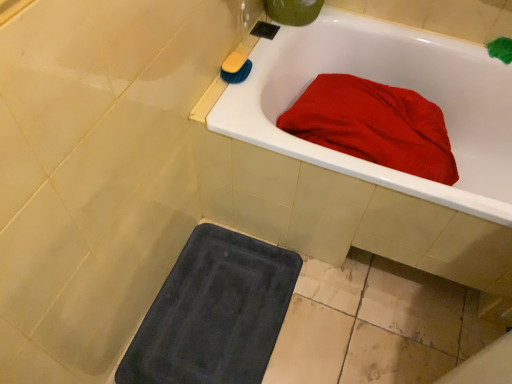
Question: Could you tell me if matte white bathtub at upper right is facing yellow sponge at upper left?

Choices:
 (A) no
 (B) yes

Answer: (A)

Question: From a real-world perspective, is matte white bathtub at upper right below yellow sponge at upper left?

Choices:
 (A) no
 (B) yes

Answer: (B)

Question: Is matte white bathtub at upper right far away from yellow sponge at upper left?

Choices:
 (A) yes
 (B) no

Answer: (B)

Question: Is matte white bathtub at upper right looking in the opposite direction of yellow sponge at upper left?

Choices:
 (A) no
 (B) yes

Answer: (A)

Question: Does matte white bathtub at upper right have a larger size compared to yellow sponge at upper left?

Choices:
 (A) no
 (B) yes

Answer: (B)

Question: Can you confirm if matte white bathtub at upper right is positioned to the left of yellow sponge at upper left?

Choices:
 (A) yes
 (B) no

Answer: (B)

Question: Is the surface of yellow sponge at upper left in direct contact with matte white bathtub at upper right?

Choices:
 (A) yes
 (B) no

Answer: (B)

Question: Can you confirm if yellow sponge at upper left is wider than matte white bathtub at upper right?

Choices:
 (A) yes
 (B) no

Answer: (B)

Question: From the image's perspective, would you say yellow sponge at upper left is positioned over matte white bathtub at upper right?

Choices:
 (A) yes
 (B) no

Answer: (A)

Question: Can you confirm if yellow sponge at upper left is shorter than matte white bathtub at upper right?

Choices:
 (A) yes
 (B) no

Answer: (A)

Question: Is yellow sponge at upper left positioned with its back to matte white bathtub at upper right?

Choices:
 (A) no
 (B) yes

Answer: (A)

Question: Can you confirm if yellow sponge at upper left is positioned to the left of matte white bathtub at upper right?

Choices:
 (A) no
 (B) yes

Answer: (B)

Question: Based on their sizes in the image, would you say yellow sponge at upper left is bigger or smaller than matte white bathtub at upper right?

Choices:
 (A) small
 (B) big

Answer: (A)